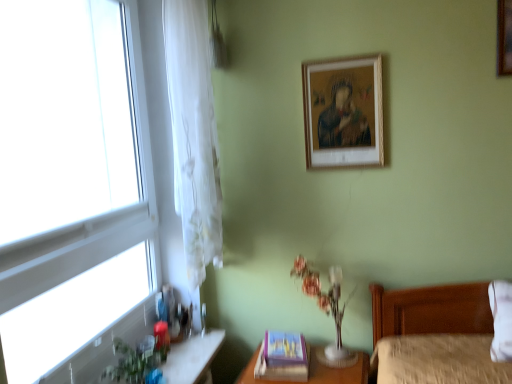
Identify the location of vacant space underneath translucent glass vase at center (from a real-world perspective). This screenshot has height=384, width=512. (334, 351).